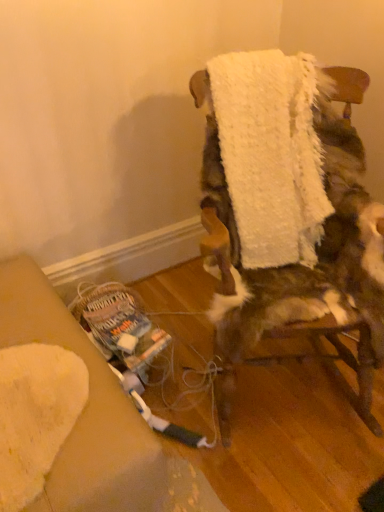
Question: Should I look upward or downward to see white fluffy towel at center?

Choices:
 (A) down
 (B) up

Answer: (B)

Question: Is white fluffy chair at center next to white fluffy towel at center and touching it?

Choices:
 (A) no
 (B) yes

Answer: (A)

Question: Considering the relative sizes of white fluffy chair at center and white fluffy towel at center in the image provided, is white fluffy chair at center smaller than white fluffy towel at center?

Choices:
 (A) yes
 (B) no

Answer: (B)

Question: Does white fluffy chair at center have a greater height compared to white fluffy towel at center?

Choices:
 (A) no
 (B) yes

Answer: (B)

Question: Is white fluffy chair at center aimed at white fluffy towel at center?

Choices:
 (A) yes
 (B) no

Answer: (B)

Question: Is white fluffy chair at center positioned before white fluffy towel at center?

Choices:
 (A) yes
 (B) no

Answer: (A)

Question: Can you confirm if white fluffy chair at center is thinner than white fluffy towel at center?

Choices:
 (A) yes
 (B) no

Answer: (B)

Question: Does white fluffy towel at center lie in front of white fluffy chair at center?

Choices:
 (A) no
 (B) yes

Answer: (A)

Question: Can you confirm if white fluffy towel at center is shorter than white fluffy chair at center?

Choices:
 (A) no
 (B) yes

Answer: (B)

Question: From the image's perspective, does white fluffy towel at center appear higher than white fluffy chair at center?

Choices:
 (A) no
 (B) yes

Answer: (B)

Question: Is white fluffy towel at center not within white fluffy chair at center?

Choices:
 (A) no
 (B) yes

Answer: (A)

Question: Is the position of white fluffy towel at center more distant than that of white fluffy chair at center?

Choices:
 (A) no
 (B) yes

Answer: (B)

Question: Is white fluffy towel at center next to white fluffy chair at center?

Choices:
 (A) yes
 (B) no

Answer: (B)

Question: Is white fluffy towel at center taller or shorter than white fluffy chair at center?

Choices:
 (A) short
 (B) tall

Answer: (A)